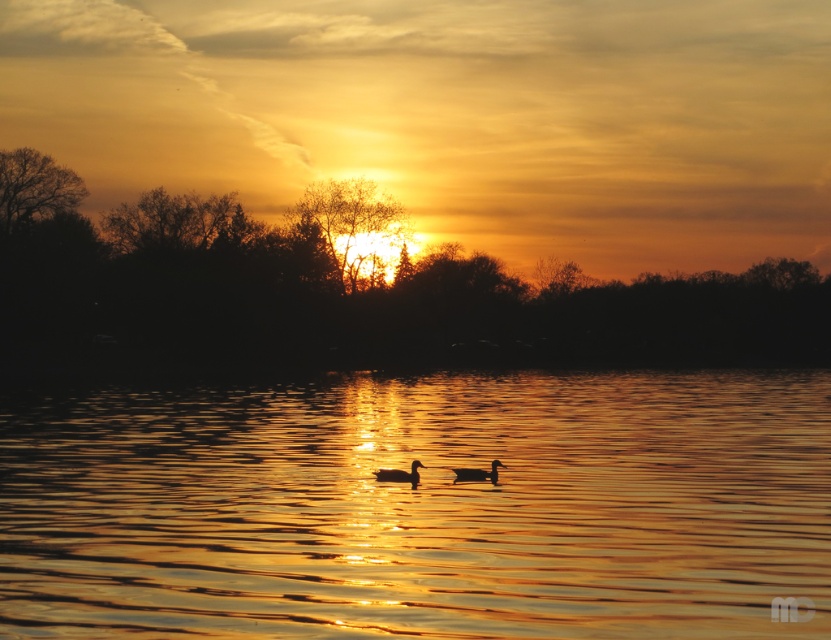
You are observing the sunset scene and notice two ducks floating on the water. Which duck is positioned to the right side when looking at the brown matte duck at center and the matte black duck at center?

The matte black duck at center is positioned to the right of the brown matte duck at center.

You are a photographer trying to capture the sunset reflection on the water. You notice the glistening golden water at center is exactly at point (421, 508). If your camera is set to focus on this point, will it also capture the silhouetted trees in the background?

The glistening golden water at center is located at point (421, 508). Since the silhouetted trees are part of the background framing the sunset, focusing on the water point may not necessarily include the trees in the frame unless the camera angle is adjusted to include both elements.

You are standing at the edge of the water and see the brown matte duck at center. If you want to throw a small pebble to reach the duck, will the pebble land closer to the duck or further away from it?

The brown matte duck at center is 25.18 meters away from the camera. If you throw a pebble towards it, the pebble will land closer to the duck than the camera, but whether it reaches the duck depends on your throwing distance. However, since the question only asks if it lands closer or further, the pebble would land closer to the duck.